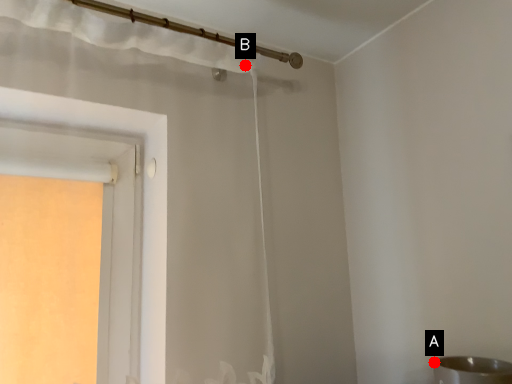
Question: Two points are circled on the image, labeled by A and B beside each circle. Among these points, which one is nearest to the camera?

Choices:
 (A) A is closer
 (B) B is closer

Answer: (A)